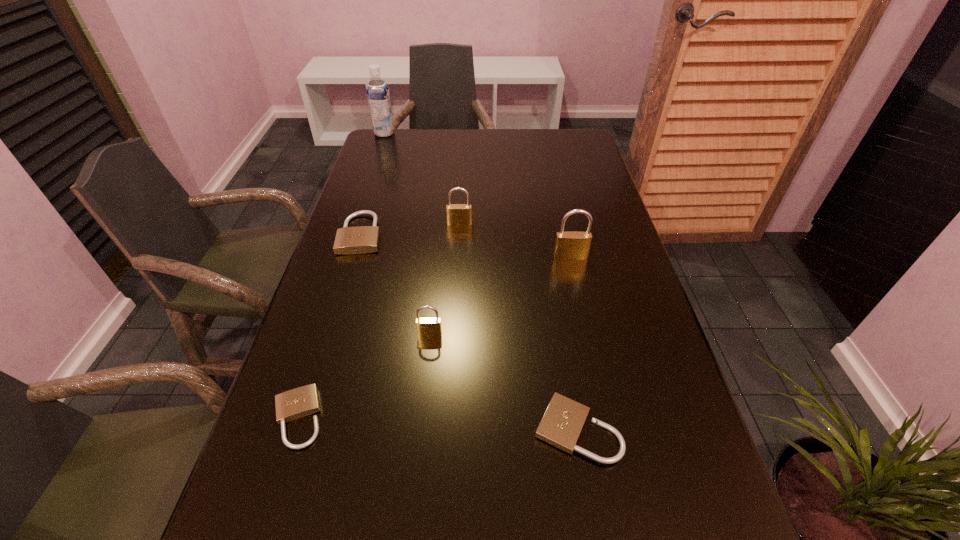
Identify the location of the tallest object. (378, 96).

Find the location of a particular element. The width and height of the screenshot is (960, 540). soya milk is located at coordinates (378, 96).

I want to click on the second nearest brass padlock, so click(573, 245).

The image size is (960, 540). Identify the location of the biggest brass padlock. (573, 245).

You are a GUI agent. You are given a task and a screenshot of the screen. Output one action in this format:
    pyautogui.click(x=<x>, y=<y>)
    Task: Click on the fifth shortest object
    Image resolution: width=960 pixels, height=540 pixels.
    Given the screenshot: What is the action you would take?
    pyautogui.click(x=457, y=214)

The height and width of the screenshot is (540, 960). Find the location of `the second tallest padlock`. the second tallest padlock is located at coordinates (457, 214).

This screenshot has height=540, width=960. Find the location of `the third tallest padlock`. the third tallest padlock is located at coordinates (429, 327).

The image size is (960, 540). Find the location of `the smallest brass padlock`. the smallest brass padlock is located at coordinates (429, 327).

This screenshot has height=540, width=960. I want to click on the fourth tallest padlock, so click(x=363, y=239).

At what (x,y) coordinates should I click in order to perform the action: click on the fifth tallest object. Please return your answer as a coordinate pair (x, y). The height and width of the screenshot is (540, 960). Looking at the image, I should click on (363, 239).